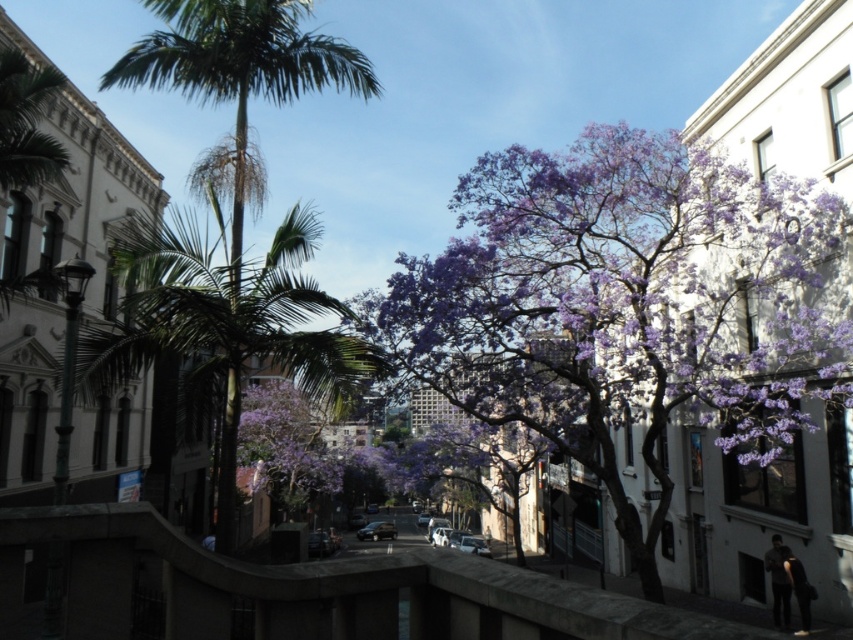
Question: Which of the following is the closest to the observer?

Choices:
 (A) (329, 44)
 (B) (846, 269)

Answer: (A)

Question: Does purple bloom at center have a larger size compared to green leafy palm tree at left?

Choices:
 (A) yes
 (B) no

Answer: (B)

Question: Can you confirm if purple bloom at center is thinner than green leafy palm tree at left?

Choices:
 (A) no
 (B) yes

Answer: (B)

Question: Is purple bloom at center wider than green leafy palm tree at left?

Choices:
 (A) no
 (B) yes

Answer: (A)

Question: Which point appears closest to the camera in this image?

Choices:
 (A) (659, 164)
 (B) (210, 12)

Answer: (B)